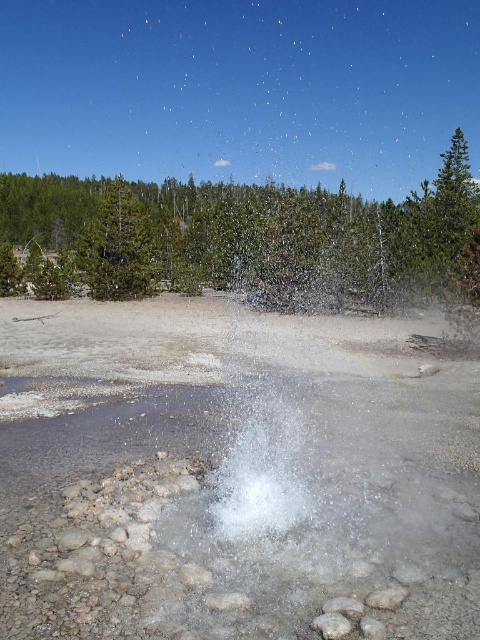
The width and height of the screenshot is (480, 640). What do you see at coordinates (240, 515) in the screenshot?
I see `clear water at center` at bounding box center [240, 515].

Locate an element on the screen. clear water at center is located at coordinates (240, 515).

Identify the location of green leafy tree at upper center. (251, 237).

Does green leafy tree at upper center appear under green matte tree at upper center?

Incorrect, green leafy tree at upper center is not positioned below green matte tree at upper center.

The image size is (480, 640). What do you see at coordinates (251, 237) in the screenshot? I see `green leafy tree at upper center` at bounding box center [251, 237].

Locate an element on the screen. This screenshot has height=640, width=480. green leafy tree at upper center is located at coordinates (251, 237).

Measure the distance between clear water at center and camera.

They are 4.12 meters apart.

Is clear water at center closer to the viewer compared to green matte tree at upper center?

Yes, clear water at center is closer to the viewer.

Who is more distant from viewer, (251,449) or (130,257)?

The point (130,257) is behind.

The height and width of the screenshot is (640, 480). What are the coordinates of `clear water at center` in the screenshot? It's located at (240, 515).